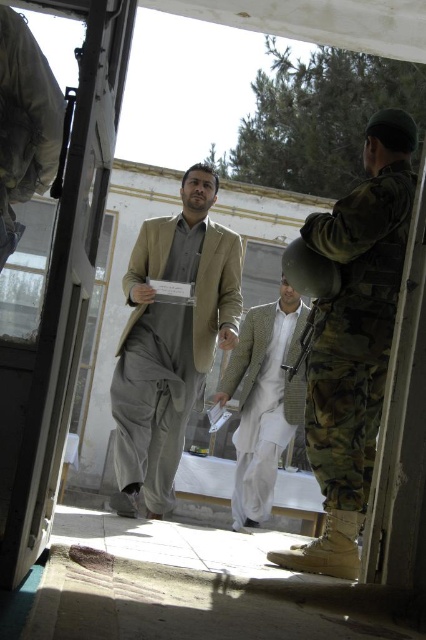
Is camo uniform helmet at right thinner than light brown textured suit at center?

Yes.

The image size is (426, 640). What do you see at coordinates (354, 340) in the screenshot?
I see `camo uniform helmet at right` at bounding box center [354, 340].

Is point (356, 365) more distant than point (284, 376)?

No, (356, 365) is closer to viewer.

The height and width of the screenshot is (640, 426). Identify the location of camo uniform helmet at right. tap(354, 340).

Between matte beige suit at center and light brown textured suit at center, which one is positioned higher?

matte beige suit at center

Is matte beige suit at center to the right of light brown textured suit at center from the viewer's perspective?

Incorrect, matte beige suit at center is not on the right side of light brown textured suit at center.

Is point (210, 348) positioned before point (235, 524)?

Yes, point (210, 348) is closer to viewer.

Image resolution: width=426 pixels, height=640 pixels. I want to click on matte beige suit at center, so click(x=170, y=340).

Consider the image. Does camo uniform helmet at right appear on the right side of matte beige suit at center?

Yes, camo uniform helmet at right is to the right of matte beige suit at center.

Can you confirm if camo uniform helmet at right is thinner than matte beige suit at center?

Indeed, camo uniform helmet at right has a lesser width compared to matte beige suit at center.

Identify the location of camo uniform helmet at right. (354, 340).